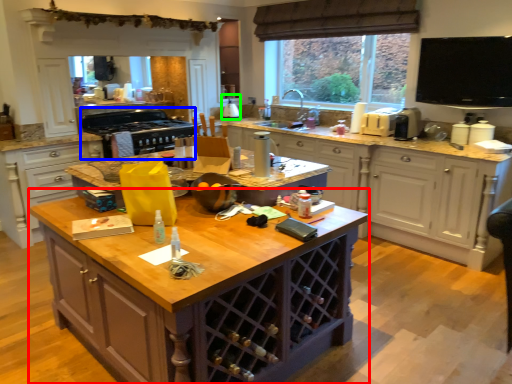
Question: Which object is positioned farthest from cabinetry (highlighted by a red box)? Select from appliance (highlighted by a blue box) and appliance (highlighted by a green box).

Choices:
 (A) appliance
 (B) appliance

Answer: (B)